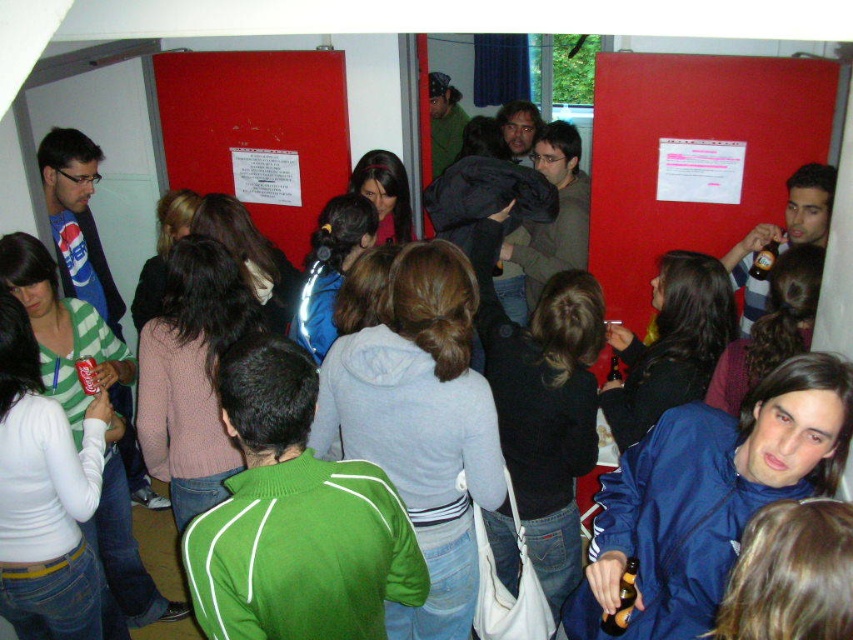
This screenshot has width=853, height=640. What do you see at coordinates (711, 493) in the screenshot?
I see `blue fabric jacket at lower right` at bounding box center [711, 493].

Can you confirm if blue fabric jacket at lower right is smaller than white paper at center?

Yes, blue fabric jacket at lower right is smaller than white paper at center.

Where is `blue fabric jacket at lower right`? blue fabric jacket at lower right is located at coordinates [x=711, y=493].

Is green sweater at center bigger than white paper at upper right?

A: Actually, green sweater at center might be smaller than white paper at upper right.

Is point (268, 388) farther from viewer compared to point (592, 225)?

No, it is in front of (592, 225).

Who is more forward, (312, 614) or (635, 305)?

Positioned in front is point (312, 614).

You are a GUI agent. You are given a task and a screenshot of the screen. Output one action in this format:
    pyautogui.click(x=<x>, y=<y>)
    Task: Click on the green sweater at center
    This screenshot has width=853, height=640.
    Given the screenshot: What is the action you would take?
    pyautogui.click(x=294, y=516)

Can you confirm if green sweater at center is shorter than white paper at center?

Indeed, green sweater at center has a lesser height compared to white paper at center.

Which is more to the left, green sweater at center or white paper at center?

white paper at center is more to the left.

This screenshot has width=853, height=640. In order to click on green sweater at center in this screenshot , I will do `click(294, 516)`.